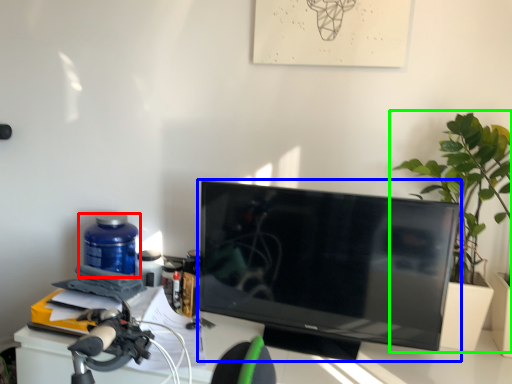
Question: Based on their relative distances, which object is nearer to bottle (highlighted by a red box)? Choose from television (highlighted by a blue box) and houseplant (highlighted by a green box).

Choices:
 (A) television
 (B) houseplant

Answer: (A)